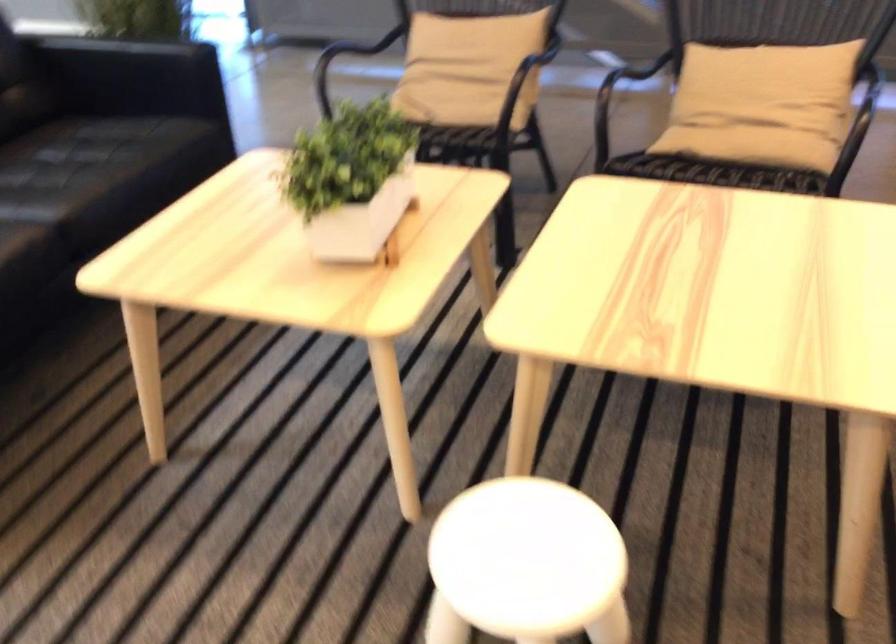
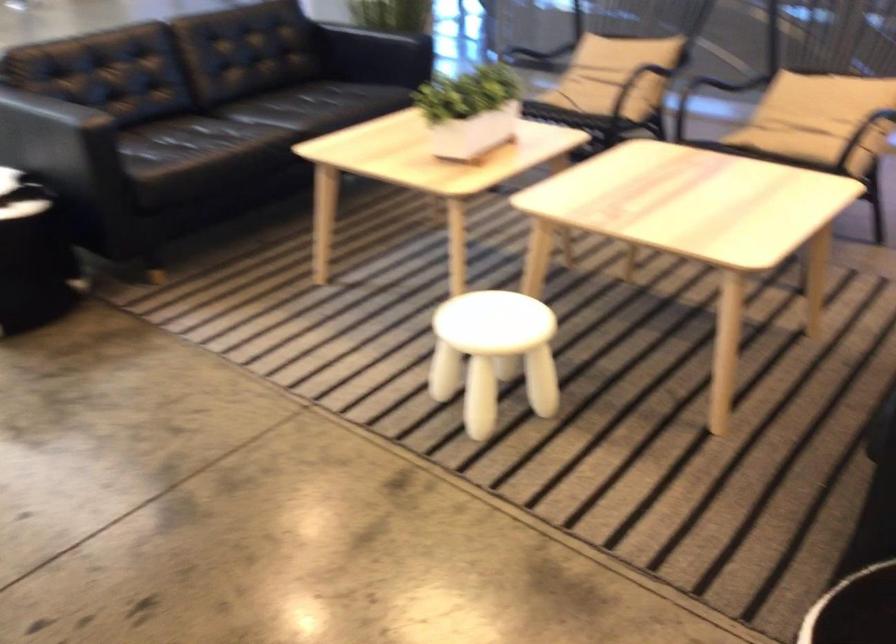
The point at (789, 118) is marked in the first image. Where is the corresponding point in the second image?

(817, 118)